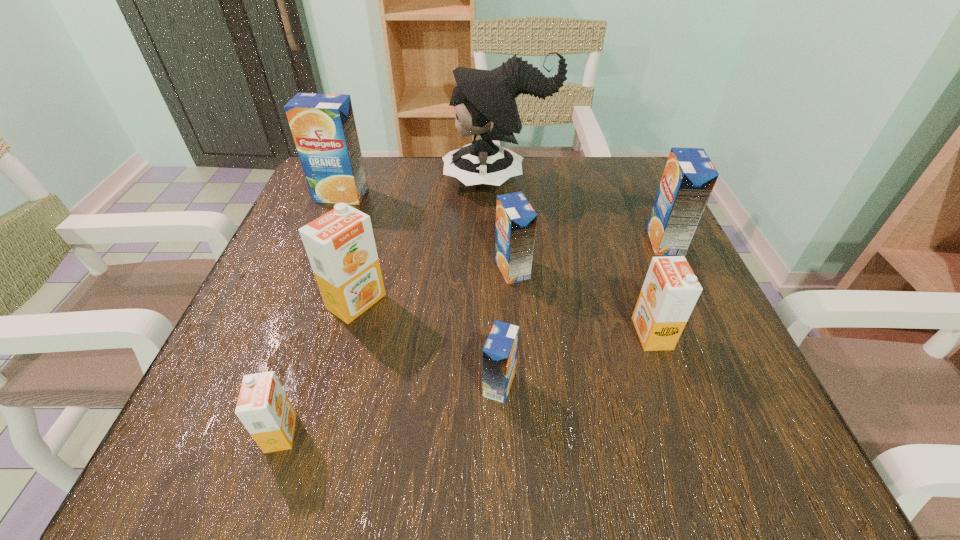
The width and height of the screenshot is (960, 540). Identify the location of the second nearest object. (500, 351).

Find the location of a particular element. the nearest orange orange juice is located at coordinates pyautogui.click(x=263, y=407).

Where is `the smallest orange orange juice`? the smallest orange orange juice is located at coordinates (263, 407).

Locate an element on the screen. Image resolution: width=960 pixels, height=540 pixels. vacant space located 0.210m at the face of the tallest object is located at coordinates (353, 180).

At what (x,y) coordinates should I click in order to perform the action: click on free spot located 0.270m at the face of the tallest object. Please return your answer as a coordinate pair (x, y). Looking at the image, I should click on (328, 180).

Where is `vacant space positioned at the face of the tallest object`? Image resolution: width=960 pixels, height=540 pixels. vacant space positioned at the face of the tallest object is located at coordinates (366, 180).

Identify the location of vacant space located 0.310m on the right of the leftmost blue orange_juice. (504, 195).

Where is `free space located on the front of the rightmost object`? This screenshot has width=960, height=540. free space located on the front of the rightmost object is located at coordinates (724, 367).

At what (x,y) coordinates should I click in order to perform the action: click on vacant area situated 0.380m on the right of the biggest orange orange juice. Please return your answer as a coordinate pair (x, y). Image resolution: width=960 pixels, height=540 pixels. Looking at the image, I should click on (605, 301).

What are the coordinates of `free space located 0.070m on the front of the third biggest blue orange_juice` in the screenshot? It's located at (516, 314).